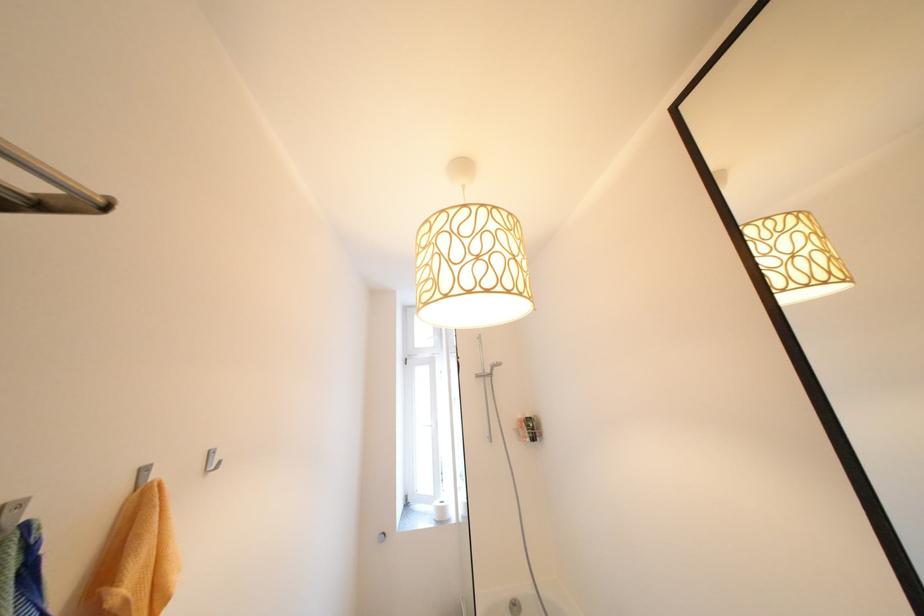
This screenshot has height=616, width=924. What do you see at coordinates (515, 607) in the screenshot?
I see `the bathtub faucet lever` at bounding box center [515, 607].